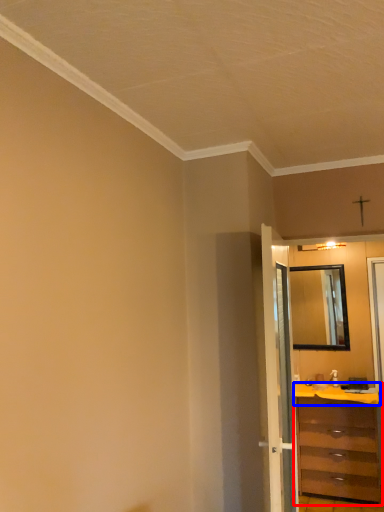
Question: Which of the following is the farthest to the observer, chest of drawers (highlighted by a red box) or counter top (highlighted by a blue box)?

Choices:
 (A) chest of drawers
 (B) counter top

Answer: (B)